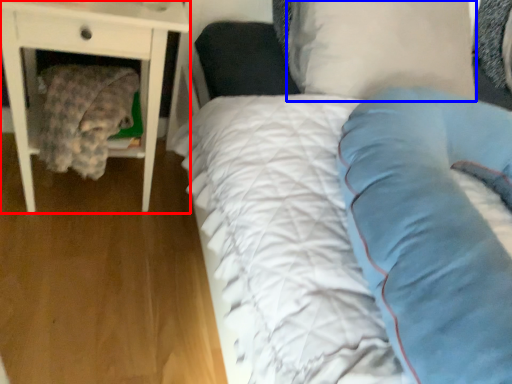
Question: Which object appears farthest to the camera in this image, nightstand (highlighted by a red box) or pillow (highlighted by a blue box)?

Choices:
 (A) nightstand
 (B) pillow

Answer: (A)